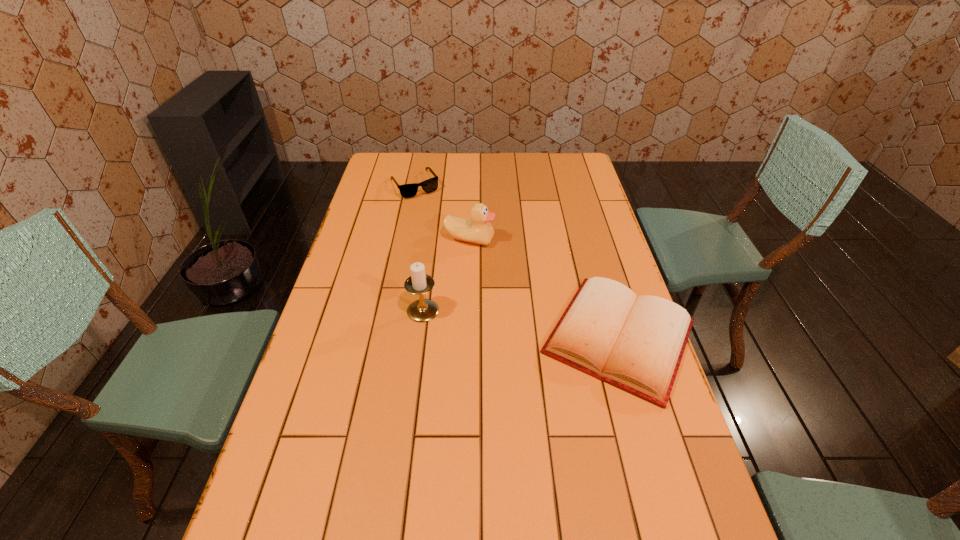
The image size is (960, 540). In order to click on candle holder in this screenshot , I will do `click(422, 310)`.

Locate an element on the screen. the rightmost object is located at coordinates (635, 343).

The image size is (960, 540). I want to click on Bible, so point(635,343).

Find the location of a particular element. the second shortest object is located at coordinates point(430,185).

Where is `the farthest object`? This screenshot has width=960, height=540. the farthest object is located at coordinates (430, 185).

Find the location of a particular element. the second tallest object is located at coordinates (478, 230).

Identify the location of the second farthest object. The height and width of the screenshot is (540, 960). (478, 230).

Image resolution: width=960 pixels, height=540 pixels. What are the coordinates of `blank space located on the front of the tallest object` in the screenshot? It's located at (406, 447).

You are a GUI agent. You are given a task and a screenshot of the screen. Output one action in this format:
    pyautogui.click(x=<x>, y=<y>)
    Task: Click on the free spot located 0.050m on the left of the Bible
    This screenshot has width=960, height=540.
    Given the screenshot: What is the action you would take?
    pyautogui.click(x=520, y=337)

What are the coordinates of `vacant space situated on the front-facing side of the sunglasses` in the screenshot? It's located at (461, 254).